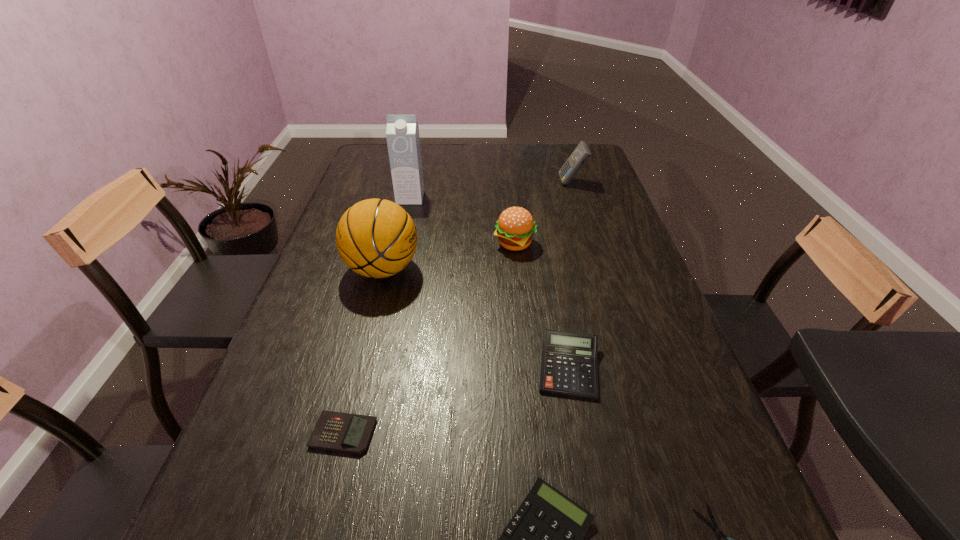
The image size is (960, 540). Identify the location of vacant area located 0.160m on the front label of the carton. (402, 233).

The image size is (960, 540). I want to click on vacant region located 0.290m on the surface of the basketball near the brand logo, so click(x=526, y=269).

Locate an element on the screen. free space located on the front-facing side of the tallest calculator is located at coordinates (458, 183).

Where is `vacant space situated 0.100m on the front-facing side of the tallest calculator`? vacant space situated 0.100m on the front-facing side of the tallest calculator is located at coordinates (531, 183).

I want to click on free spot located 0.360m on the front-facing side of the tallest calculator, so click(458, 183).

Find the location of a particular element. vacant space situated on the front of the hamburger is located at coordinates (522, 324).

Identify the location of free space located 0.220m on the front of the second tallest calculator. The height and width of the screenshot is (540, 960). (x=596, y=515).

Locate an element on the screen. The width and height of the screenshot is (960, 540). vacant region located 0.100m on the left of the second nearest calculator is located at coordinates (260, 433).

Identify the location of basketball present at the left edge. Image resolution: width=960 pixels, height=540 pixels. (376, 238).

At what (x,y) coordinates should I click in order to perform the action: click on calculator that is at the left edge. Please return your answer as a coordinate pair (x, y). Looking at the image, I should click on (336, 431).